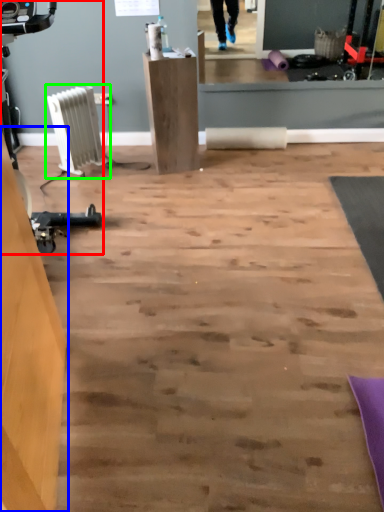
Question: Which object is positioned closest to sport equipment (highlighted by a red box)? Select from furniture (highlighted by a blue box) and radiator (highlighted by a green box).

Choices:
 (A) furniture
 (B) radiator

Answer: (B)